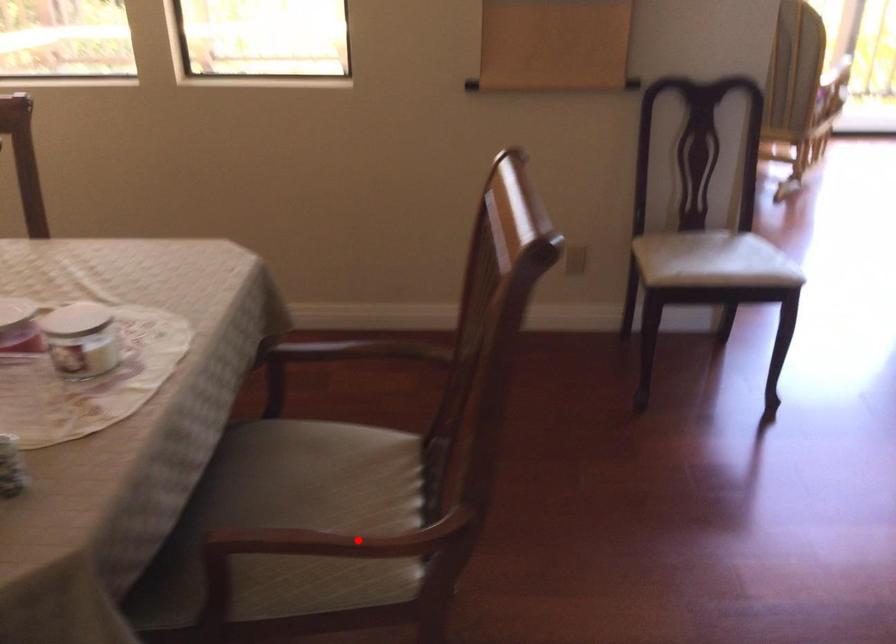
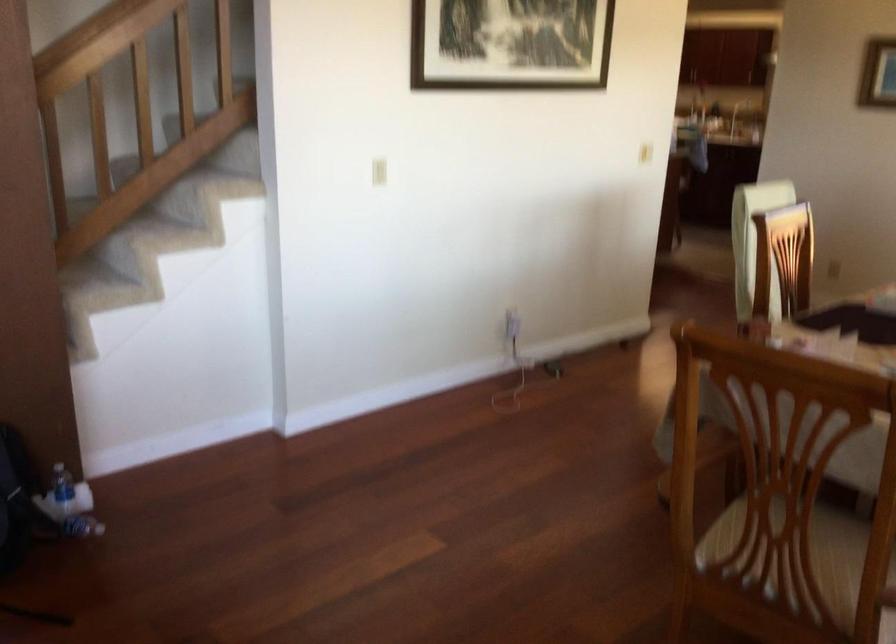
Find the pixel in the second image that matches the highlighted location in the first image.

(736, 532)